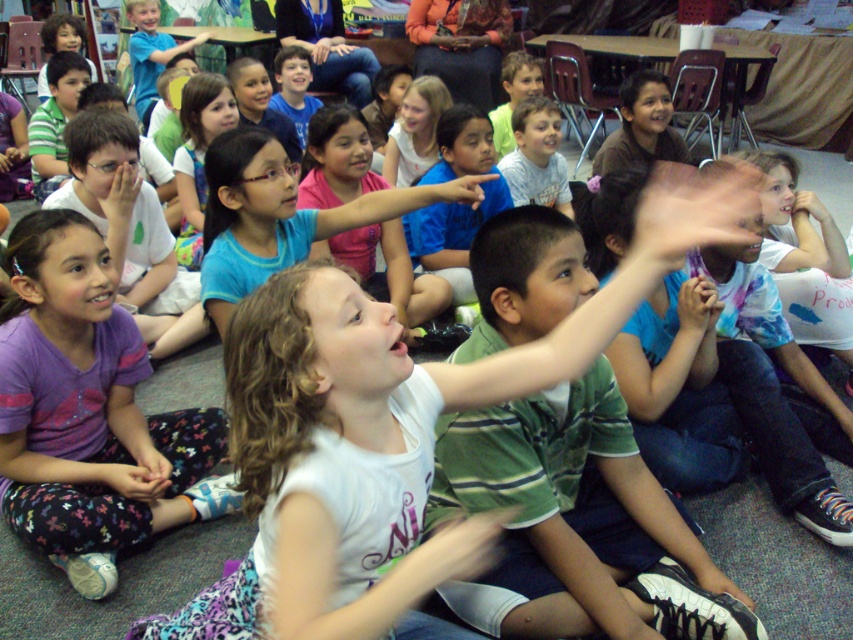
Which is more to the right, blue jeans at upper center or matte tie-dye shirt at center?

matte tie-dye shirt at center

Which of these two, blue jeans at upper center or matte tie-dye shirt at center, stands shorter?

With less height is matte tie-dye shirt at center.

Find the location of a particular element. blue jeans at upper center is located at coordinates [326, 48].

Between point (6, 365) and point (485, 26), which one is positioned behind?

Point (485, 26)

Is purple cotton shirt at lower left behind orange fabric at upper center?

No.

Locate an element on the screen. purple cotton shirt at lower left is located at coordinates (85, 406).

Where is `purple cotton shirt at lower left`? The image size is (853, 640). purple cotton shirt at lower left is located at coordinates (85, 406).

Does blue jeans at upper center appear on the right side of blue matte hand at center?

In fact, blue jeans at upper center is to the left of blue matte hand at center.

Is point (314, 6) farther from camera compared to point (440, 188)?

Yes, it is.

Is point (311, 49) less distant than point (468, 195)?

No, (311, 49) is behind (468, 195).

I want to click on blue jeans at upper center, so click(x=326, y=48).